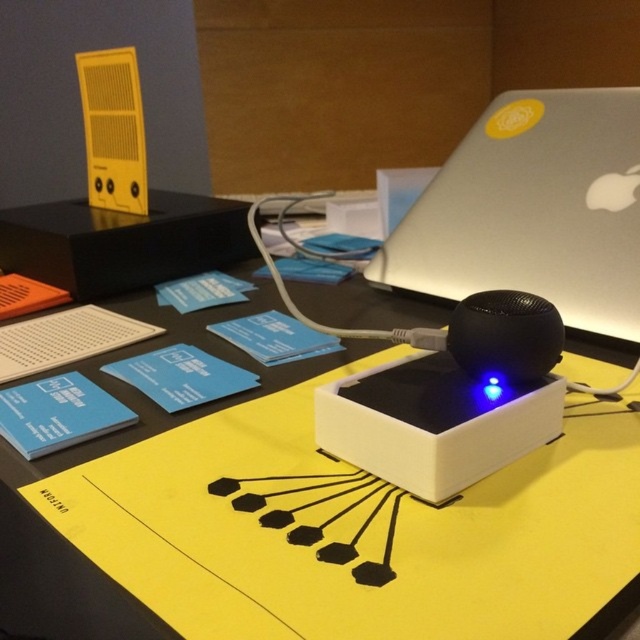
Question: Which point is farther to the camera?

Choices:
 (A) black matte box at upper left
 (B) yellow matte table at center

Answer: (A)

Question: Does yellow matte table at center lie behind black matte box at upper left?

Choices:
 (A) yes
 (B) no

Answer: (B)

Question: Does yellow matte table at center have a lesser width compared to silver metallic laptop at upper right?

Choices:
 (A) no
 (B) yes

Answer: (A)

Question: Which object is farther from the camera taking this photo?

Choices:
 (A) silver metallic laptop at upper right
 (B) yellow matte table at center
 (C) black matte box at upper left

Answer: (C)

Question: Can you confirm if silver metallic laptop at upper right is positioned to the right of black matte box at upper left?

Choices:
 (A) yes
 (B) no

Answer: (A)

Question: Which point is farther from the camera taking this photo?

Choices:
 (A) (403, 616)
 (B) (454, 170)
 (C) (156, 220)

Answer: (C)